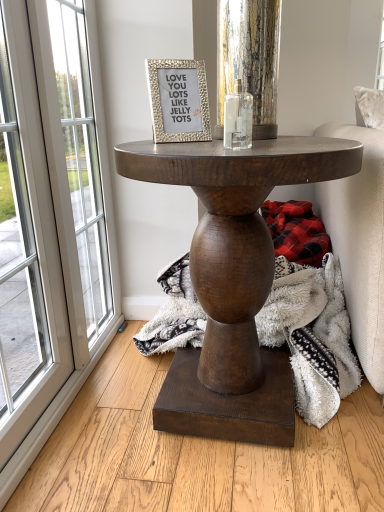
Question: Considering the positions of plaid fabric at lower right and clear glass candle holder at center in the image, is plaid fabric at lower right taller or shorter than clear glass candle holder at center?

Choices:
 (A) tall
 (B) short

Answer: (A)

Question: In the image, is plaid fabric at lower right on the left side or the right side of clear glass candle holder at center?

Choices:
 (A) left
 (B) right

Answer: (B)

Question: Which object is the farthest from the clear glass candle holder at center?

Choices:
 (A) gold textured frame at upper center
 (B) plaid fabric at lower right
 (C) white glass screen door at left
 (D) dark wood table at center

Answer: (B)

Question: Which object is positioned farthest from the dark wood table at center?

Choices:
 (A) gold textured frame at upper center
 (B) clear glass candle holder at center
 (C) plaid fabric at lower right
 (D) white glass screen door at left

Answer: (C)